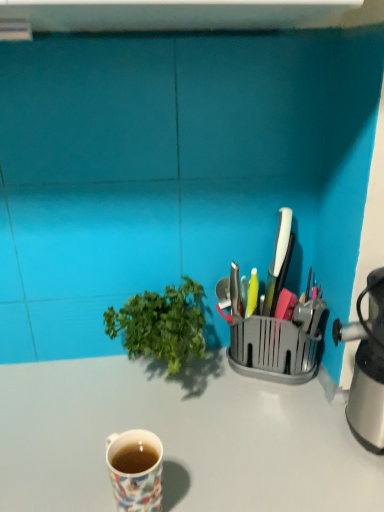
This screenshot has width=384, height=512. Identify the location of free spot in front of green leafy plant at center. (163, 467).